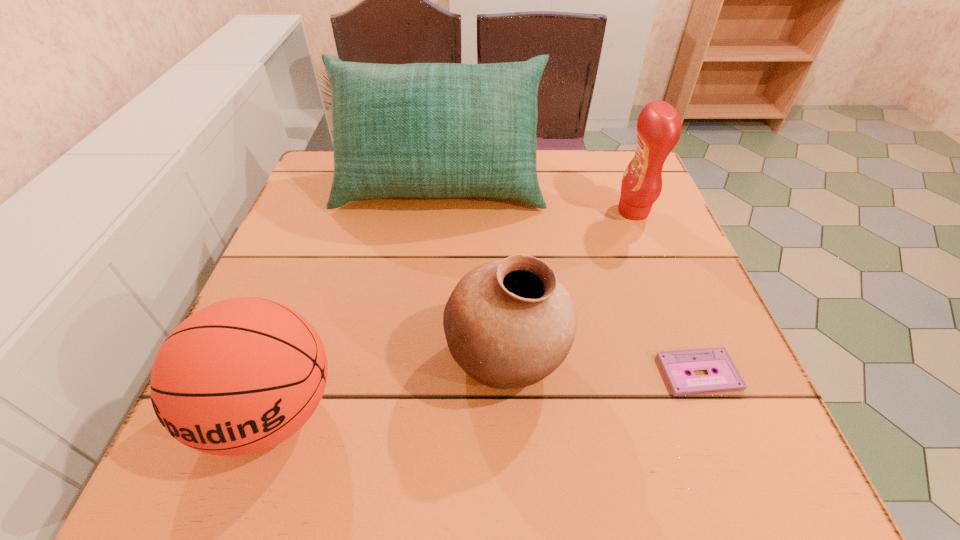
This screenshot has height=540, width=960. Identify the location of cushion. (425, 130).

The image size is (960, 540). I want to click on condiment, so click(x=659, y=127).

Locate an element on the screen. pottery is located at coordinates (509, 323).

Where is `basketball`? basketball is located at coordinates [x=242, y=375].

I want to click on videotape, so click(x=675, y=364).

At what (x,y) coordinates should I click in order to perform the action: click on free space located on the front-facing side of the cushion. Please return your answer as a coordinate pair (x, y). Looking at the image, I should click on (423, 335).

Image resolution: width=960 pixels, height=540 pixels. In order to click on blank area located 0.200m on the label side of the condiment in this screenshot , I will do `click(533, 211)`.

At what (x,y) coordinates should I click in order to perform the action: click on vacant region located on the label side of the condiment. Please return your answer as a coordinate pair (x, y). This screenshot has height=540, width=960. Looking at the image, I should click on (475, 211).

Identify the location of vacant space located 0.180m on the label side of the condiment. The height and width of the screenshot is (540, 960). (541, 211).

Locate an element on the screen. The width and height of the screenshot is (960, 540). vacant area situated 0.380m on the back of the pottery is located at coordinates (498, 197).